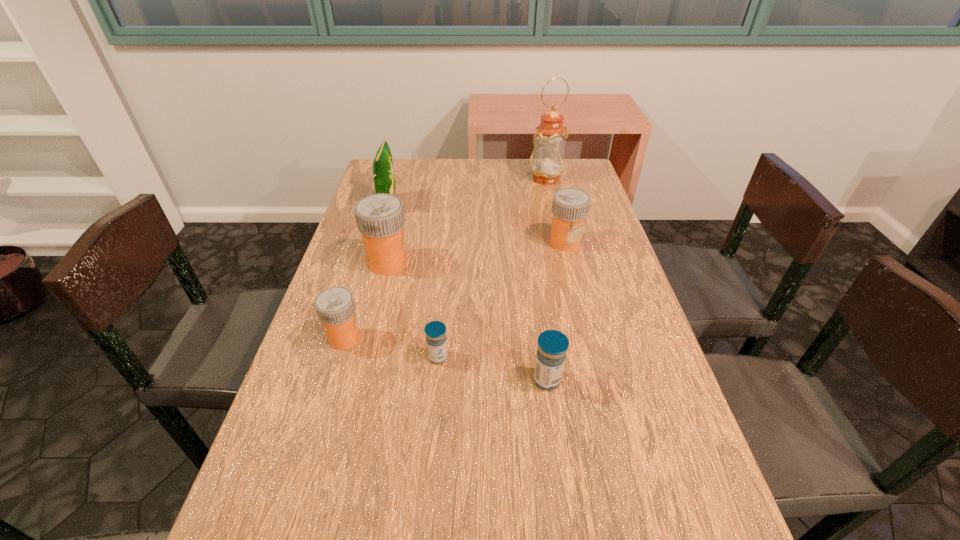
Locate an element on the screen. Image resolution: width=960 pixels, height=540 pixels. vacant space that satisfies the following two spatial constraints: 1. on the back side of the left blue medicine; 2. on the label side of the smallest orange medicine is located at coordinates (440, 338).

Where is `free space that satisfies the following two spatial constraints: 1. on the back side of the shortest medicine; 2. on the label side of the tallest medicine`? free space that satisfies the following two spatial constraints: 1. on the back side of the shortest medicine; 2. on the label side of the tallest medicine is located at coordinates (446, 262).

Where is `vacant space that satisfies the following two spatial constraints: 1. on the front-facing side of the sixth nearest object; 2. on the right side of the farther blue medicine`? The height and width of the screenshot is (540, 960). vacant space that satisfies the following two spatial constraints: 1. on the front-facing side of the sixth nearest object; 2. on the right side of the farther blue medicine is located at coordinates (345, 357).

Identify the location of free spot that satisfies the following two spatial constraints: 1. on the front side of the oil lamp; 2. on the front-facing side of the sixth nearest object. (551, 205).